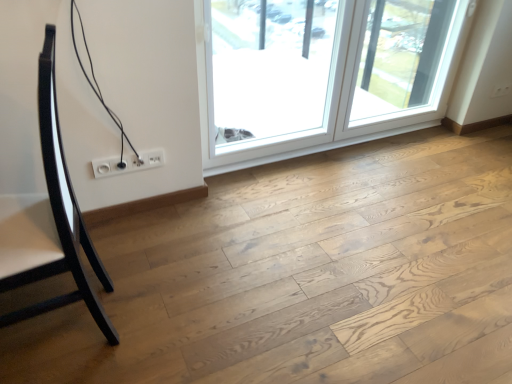
This screenshot has width=512, height=384. Find the location of `empty space that is ontop of natural wood floor at center`. empty space that is ontop of natural wood floor at center is located at coordinates (307, 253).